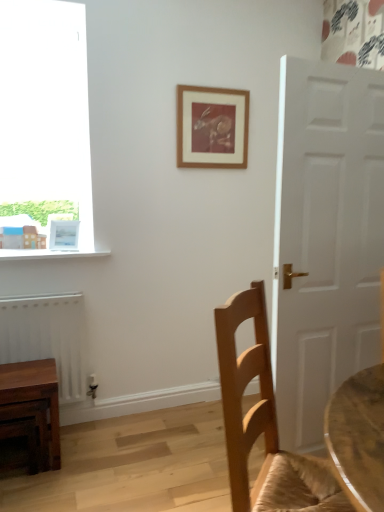
Identify the location of wooden picture frame at upper center, which is counted as the 2th picture frame, starting from the bottom. (212, 127).

Describe the element at coordinates (33, 402) in the screenshot. This screenshot has height=512, width=384. I see `wooden table at lower left` at that location.

Find the location of `light brown wood chair at right`. light brown wood chair at right is located at coordinates (264, 423).

The image size is (384, 512). In order to click on wooden picture frame at upper center, which is counted as the 1th picture frame, starting from the right in this screenshot , I will do `click(212, 127)`.

From the image's perspective, is white matte radiator at lower left located above or below white glossy picture frame at upper left, which ranks as the 2th picture frame in right-to-left order?

white matte radiator at lower left is situated lower than white glossy picture frame at upper left, which ranks as the 2th picture frame in right-to-left order, in the image.

Which is in front, point (68, 361) or point (59, 239)?

The point (68, 361) is in front.

Between white matte radiator at lower left and white glossy picture frame at upper left, acting as the 1th picture frame starting from the left, which one has less height?

With less height is white glossy picture frame at upper left, acting as the 1th picture frame starting from the left.

Looking at their sizes, would you say white matte radiator at lower left is wider or thinner than white glossy picture frame at upper left, which ranks as the 2th picture frame in right-to-left order?

Considering their sizes, white matte radiator at lower left looks broader than white glossy picture frame at upper left, which ranks as the 2th picture frame in right-to-left order.

The image size is (384, 512). I want to click on chair on the right side of wooden picture frame at upper center, marked as the 2th picture frame in a left-to-right arrangement, so click(264, 423).

Which of these two, wooden picture frame at upper center, marked as the 2th picture frame in a left-to-right arrangement, or light brown wood chair at right, is smaller?

With smaller size is wooden picture frame at upper center, marked as the 2th picture frame in a left-to-right arrangement.

Considering the relative sizes of wooden picture frame at upper center, marked as the 2th picture frame in a left-to-right arrangement, and light brown wood chair at right in the image provided, is wooden picture frame at upper center, marked as the 2th picture frame in a left-to-right arrangement, wider than light brown wood chair at right?

In fact, wooden picture frame at upper center, marked as the 2th picture frame in a left-to-right arrangement, might be narrower than light brown wood chair at right.

From the image's perspective, is wooden picture frame at upper center, marked as the 2th picture frame in a left-to-right arrangement, under light brown wood chair at right?

No.

Which object is wider, white matte radiator at lower left or wooden table at lower left?

With larger width is wooden table at lower left.

Considering the positions of point (59, 303) and point (13, 379), is point (59, 303) closer or farther from the camera than point (13, 379)?

Point (59, 303) appears to be farther away from the viewer than point (13, 379).

How much distance is there between white matte radiator at lower left and wooden table at lower left?

They are 9.95 inches apart.

Is white matte radiator at lower left situated inside wooden table at lower left or outside?

white matte radiator at lower left is outside wooden table at lower left.

From their relative heights in the image, would you say light brown wood chair at right is taller or shorter than white glossy picture frame at upper left, the 2th picture frame positioned from the top?

light brown wood chair at right is taller than white glossy picture frame at upper left, the 2th picture frame positioned from the top.

Is light brown wood chair at right facing towards white glossy picture frame at upper left, acting as the 1th picture frame starting from the left?

No, light brown wood chair at right does not turn towards white glossy picture frame at upper left, acting as the 1th picture frame starting from the left.

Is point (247, 434) closer to camera compared to point (60, 241)?

Yes, it is.

Is light brown wood chair at right not close to white matte radiator at lower left?

Indeed, light brown wood chair at right is not near white matte radiator at lower left.

Does light brown wood chair at right have a larger size compared to white matte radiator at lower left?

Correct, light brown wood chair at right is larger in size than white matte radiator at lower left.

Does light brown wood chair at right have a greater width compared to white matte radiator at lower left?

Yes.

Can you confirm if wooden table at lower left is thinner than white glossy picture frame at upper left, the 2th picture frame positioned from the top?

No.

From a real-world perspective, relative to white glossy picture frame at upper left, the 2th picture frame positioned from the top, is wooden table at lower left vertically above or below?

wooden table at lower left is below white glossy picture frame at upper left, the 2th picture frame positioned from the top.

What's the angular difference between wooden table at lower left and white glossy picture frame at upper left, which ranks as the 2th picture frame in right-to-left order,'s facing directions?

The facing directions of wooden table at lower left and white glossy picture frame at upper left, which ranks as the 2th picture frame in right-to-left order, are 22 degrees apart.

Is wooden table at lower left further to the viewer compared to white glossy picture frame at upper left, the 2th picture frame positioned from the top?

No, the depth of wooden table at lower left is less than that of white glossy picture frame at upper left, the 2th picture frame positioned from the top.

Does light brown wood chair at right come in front of wooden picture frame at upper center, which is counted as the 2th picture frame, starting from the bottom?

That is True.

How many degrees apart are the facing directions of light brown wood chair at right and wooden picture frame at upper center, marked as the 2th picture frame in a left-to-right arrangement?

46.3 degrees.

From a real-world perspective, does light brown wood chair at right stand above wooden picture frame at upper center, which is counted as the 1th picture frame, starting from the right?

No, from a real-world perspective, light brown wood chair at right is not above wooden picture frame at upper center, which is counted as the 1th picture frame, starting from the right.

Is light brown wood chair at right far from wooden picture frame at upper center, which is counted as the 2th picture frame, starting from the bottom?

light brown wood chair at right is positioned a significant distance from wooden picture frame at upper center, which is counted as the 2th picture frame, starting from the bottom.

Locate an element on the screen. The image size is (384, 512). the 1st picture frame above the white matte radiator at lower left (from the image's perspective) is located at coordinates (64, 234).

Where is `picture frame that is the 1st object to the left of the light brown wood chair at right, starting at the anchor`? picture frame that is the 1st object to the left of the light brown wood chair at right, starting at the anchor is located at coordinates (212, 127).

In the scene shown: Looking at the image, which one is located further to wooden table at lower left, wooden picture frame at upper center, arranged as the first picture frame when viewed from the top, or white matte radiator at lower left?

wooden picture frame at upper center, arranged as the first picture frame when viewed from the top, is further to wooden table at lower left.

When comparing their distances from light brown wood chair at right, does wooden picture frame at upper center, arranged as the first picture frame when viewed from the top, or white glossy picture frame at upper left, the 2th picture frame positioned from the top, seem further?

white glossy picture frame at upper left, the 2th picture frame positioned from the top.

Considering their positions, is white matte radiator at lower left positioned further to wooden picture frame at upper center, arranged as the first picture frame when viewed from the top, than wooden table at lower left?

wooden table at lower left.

Estimate the real-world distances between objects in this image. Which object is further from wooden picture frame at upper center, which is counted as the 1th picture frame, starting from the right, light brown wood chair at right or white glossy picture frame at upper left, which ranks as the 2th picture frame in right-to-left order?

Among the two, light brown wood chair at right is located further to wooden picture frame at upper center, which is counted as the 1th picture frame, starting from the right.

Based on their spatial positions, is light brown wood chair at right or wooden table at lower left closer to white glossy picture frame at upper left, acting as the 1th picture frame starting from the left?

wooden table at lower left is positioned closer to the anchor white glossy picture frame at upper left, acting as the 1th picture frame starting from the left.

Looking at the image, which one is located further to wooden picture frame at upper center, which is counted as the 2th picture frame, starting from the bottom, white matte radiator at lower left or white glossy picture frame at upper left, which ranks as the 2th picture frame in right-to-left order?

Based on the image, white matte radiator at lower left appears to be further to wooden picture frame at upper center, which is counted as the 2th picture frame, starting from the bottom.

From the image, which object appears to be nearer to white glossy picture frame at upper left, which ranks as the 2th picture frame in right-to-left order, wooden table at lower left or light brown wood chair at right?

The object closer to white glossy picture frame at upper left, which ranks as the 2th picture frame in right-to-left order, is wooden table at lower left.

Which object lies nearer to the anchor point white matte radiator at lower left, white glossy picture frame at upper left, acting as the 1th picture frame starting from the left, or wooden table at lower left?

wooden table at lower left is closer to white matte radiator at lower left.

Find the location of a particular element. table positioned between light brown wood chair at right and white glossy picture frame at upper left, which ranks as the 2th picture frame in right-to-left order, from near to far is located at coordinates (33, 402).

Find the location of a particular element. picture frame between wooden picture frame at upper center, marked as the 2th picture frame in a left-to-right arrangement, and wooden table at lower left in the up-down direction is located at coordinates (64, 234).

Locate an element on the screen. radiator between light brown wood chair at right and white glossy picture frame at upper left, the 2th picture frame positioned from the top, from front to back is located at coordinates (47, 337).

Where is `chair between wooden picture frame at upper center, which is counted as the 1th picture frame, starting from the right, and wooden table at lower left, in the vertical direction`? The image size is (384, 512). chair between wooden picture frame at upper center, which is counted as the 1th picture frame, starting from the right, and wooden table at lower left, in the vertical direction is located at coordinates (264, 423).